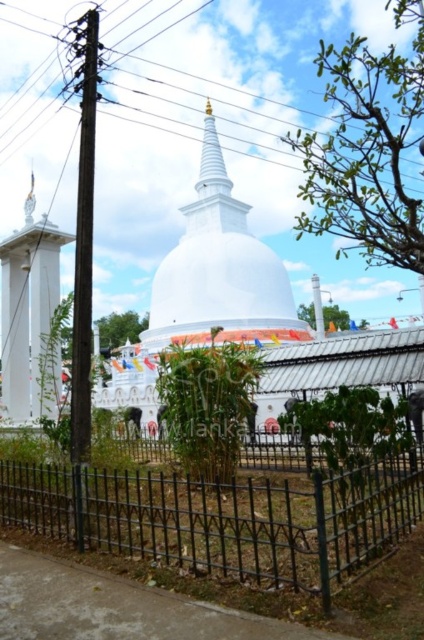
You are a bird flying over the white stupa. You want to land on the black wrought iron fence at lower center. However, there is a black plastic power line at upper center in the way. Can you safely land on the fence without touching the power line?

The black plastic power line at upper center is above the black wrought iron fence at lower center, so you can safely land on the fence without touching the power line as it is positioned higher up.

You are a photographer planning to capture the gold polished stupa at center and the black wrought iron fence at lower center in a single frame. Based on their positions, which object should you focus on first to ensure both are in the shot?

The black wrought iron fence at lower center is positioned on the left side of the gold polished stupa at center. To ensure both are in the shot, focus on the gold polished stupa at center first as it is centrally located, allowing the fence to naturally fall into the frame on its left side.

You are a visitor at the stupa and want to take a photo of the gold polished stupa at center without any obstructions. The black wrought iron fence at lower center is in your way. Can you step back enough to capture the stupa fully in your photo?

The black wrought iron fence at lower center is not as tall as the gold polished stupa at center, so stepping back should allow you to frame the stupa above the fence, capturing it fully without obstruction.